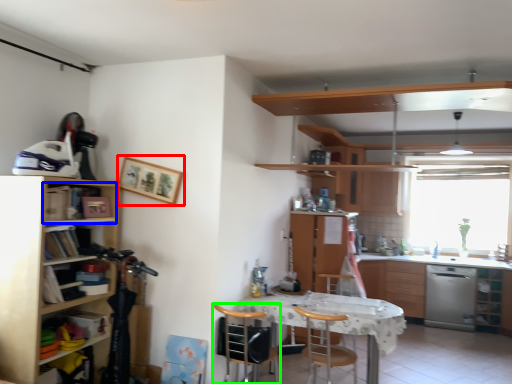
Question: Estimate the real-world distances between objects in this image. Which object is closer to picture frame (highlighted by a red box), cabinet (highlighted by a blue box) or chair (highlighted by a green box)?

Choices:
 (A) cabinet
 (B) chair

Answer: (A)